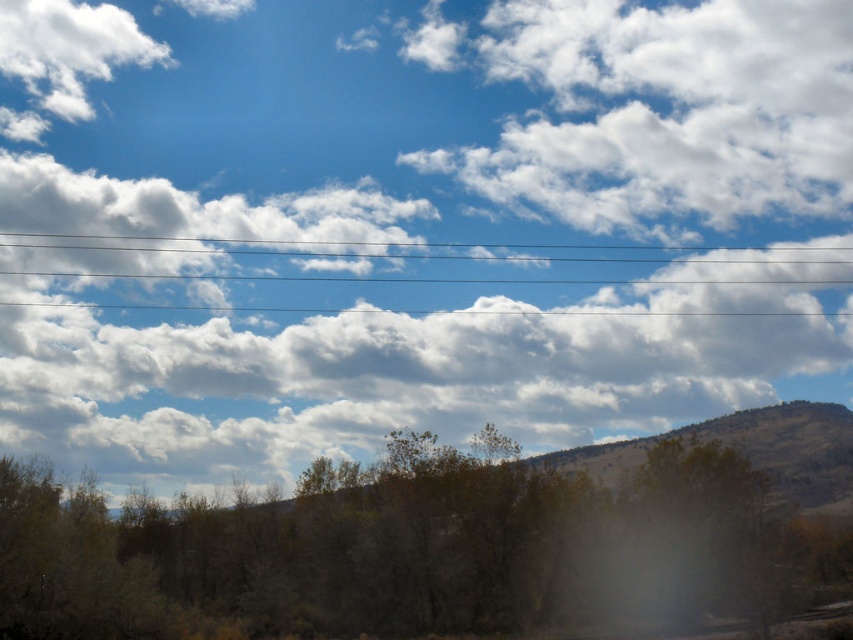
Question: Which object appears closest to the camera in this image?

Choices:
 (A) brown matte tree at center
 (B) brown textured hill at center-right
 (C) clear plastic power lines at upper center

Answer: (A)

Question: Which is nearer to the brown textured hill at center-right?

Choices:
 (A) clear plastic power lines at upper center
 (B) brown matte tree at center

Answer: (B)

Question: Among these points, which one is nearest to the camera?

Choices:
 (A) (811, 480)
 (B) (822, 260)
 (C) (556, 552)

Answer: (C)

Question: Does brown textured hill at center-right have a greater width compared to clear plastic power lines at upper center?

Choices:
 (A) yes
 (B) no

Answer: (B)

Question: Can you confirm if brown matte tree at center is smaller than brown textured hill at center-right?

Choices:
 (A) no
 (B) yes

Answer: (A)

Question: Is brown matte tree at center bigger than clear plastic power lines at upper center?

Choices:
 (A) no
 (B) yes

Answer: (B)